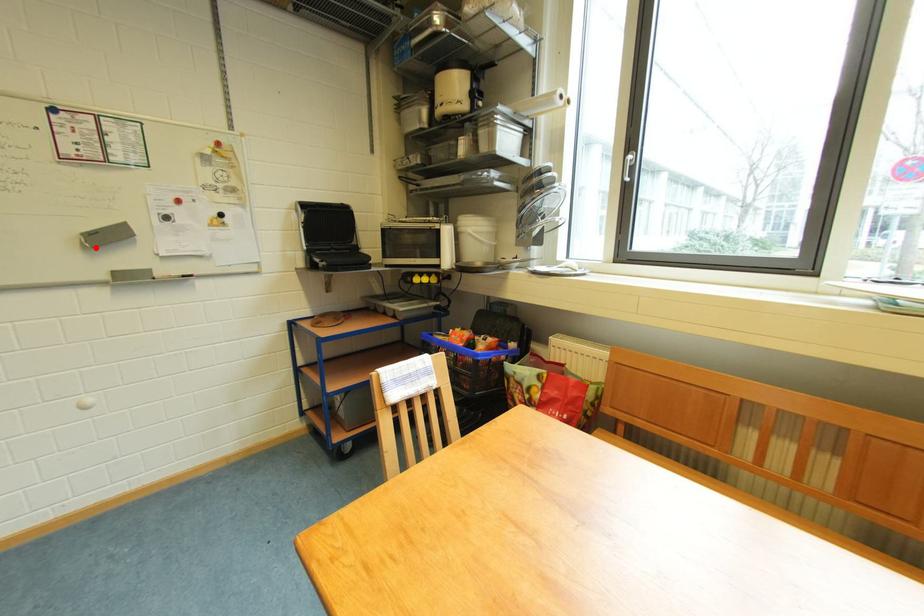
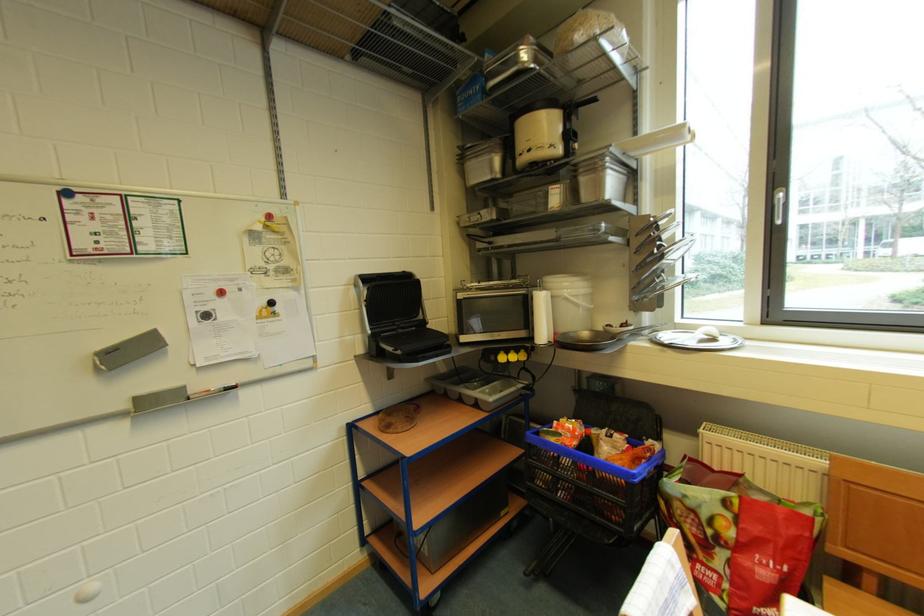
Where in the second image is the point corresponding to the highlighted location from the first image?

(110, 370)